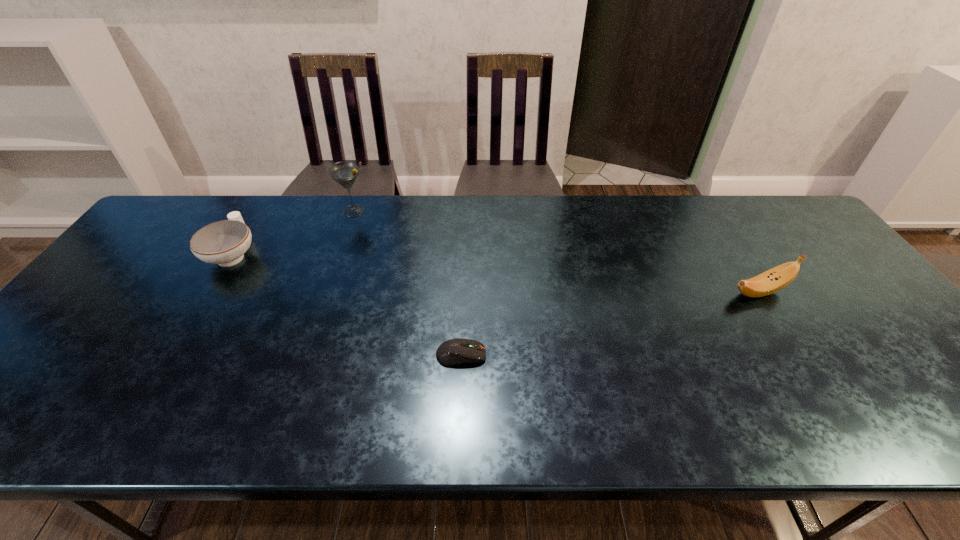
Identify the location of the tallest object. (345, 173).

You are a GUI agent. You are given a task and a screenshot of the screen. Output one action in this format:
    pyautogui.click(x=<x>, y=<y>)
    Task: Click on the second object from left to right
    This screenshot has width=960, height=540.
    Given the screenshot: What is the action you would take?
    pyautogui.click(x=345, y=173)

In order to click on banana in this screenshot , I will do `click(775, 279)`.

Locate an element on the screen. This screenshot has width=960, height=540. the third farthest object is located at coordinates (775, 279).

Identify the location of the leftmost object. (224, 242).

Where is `chinaware`? The image size is (960, 540). chinaware is located at coordinates (224, 242).

The height and width of the screenshot is (540, 960). I want to click on the nearest object, so click(x=454, y=351).

This screenshot has width=960, height=540. I want to click on computer equipment, so click(454, 351).

Where is `free location located on the right of the second object from left to right`? free location located on the right of the second object from left to right is located at coordinates (423, 211).

Find the location of a particular element. free spot located 0.400m on the back of the banana is located at coordinates (701, 198).